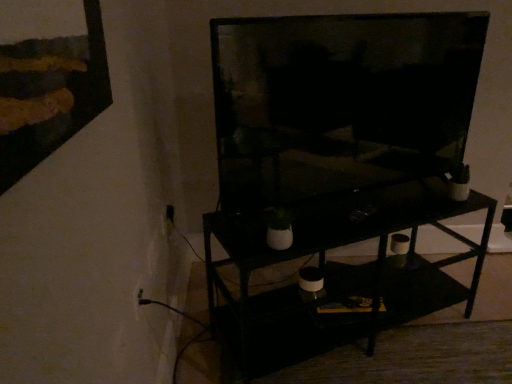
Question: Can you confirm if matte black tv at center is positioned to the right of white plastic electric outlet at lower left?

Choices:
 (A) no
 (B) yes

Answer: (B)

Question: From a real-world perspective, is matte black tv at center located beneath white plastic electric outlet at lower left?

Choices:
 (A) yes
 (B) no

Answer: (B)

Question: From a real-world perspective, is matte black tv at center on top of white plastic electric outlet at lower left?

Choices:
 (A) no
 (B) yes

Answer: (B)

Question: Does matte black tv at center have a smaller size compared to white plastic electric outlet at lower left?

Choices:
 (A) yes
 (B) no

Answer: (B)

Question: Is matte black tv at center facing away from white plastic electric outlet at lower left?

Choices:
 (A) no
 (B) yes

Answer: (A)

Question: Is matte black tv at center taller than white plastic electric outlet at lower left?

Choices:
 (A) yes
 (B) no

Answer: (A)

Question: Is white plastic electric outlet at lower left aimed at matte black tv at center?

Choices:
 (A) no
 (B) yes

Answer: (A)

Question: Can you confirm if white plastic electric outlet at lower left is taller than matte black tv at center?

Choices:
 (A) no
 (B) yes

Answer: (A)

Question: From the image's perspective, would you say white plastic electric outlet at lower left is shown under matte black tv at center?

Choices:
 (A) yes
 (B) no

Answer: (A)

Question: Is white plastic electric outlet at lower left not inside matte black tv at center?

Choices:
 (A) no
 (B) yes

Answer: (B)

Question: Is white plastic electric outlet at lower left turned away from matte black tv at center?

Choices:
 (A) yes
 (B) no

Answer: (B)

Question: Does white plastic electric outlet at lower left come behind matte black tv at center?

Choices:
 (A) yes
 (B) no

Answer: (A)

Question: Does black matte shelf at center have a larger size compared to matte black tv at center?

Choices:
 (A) no
 (B) yes

Answer: (B)